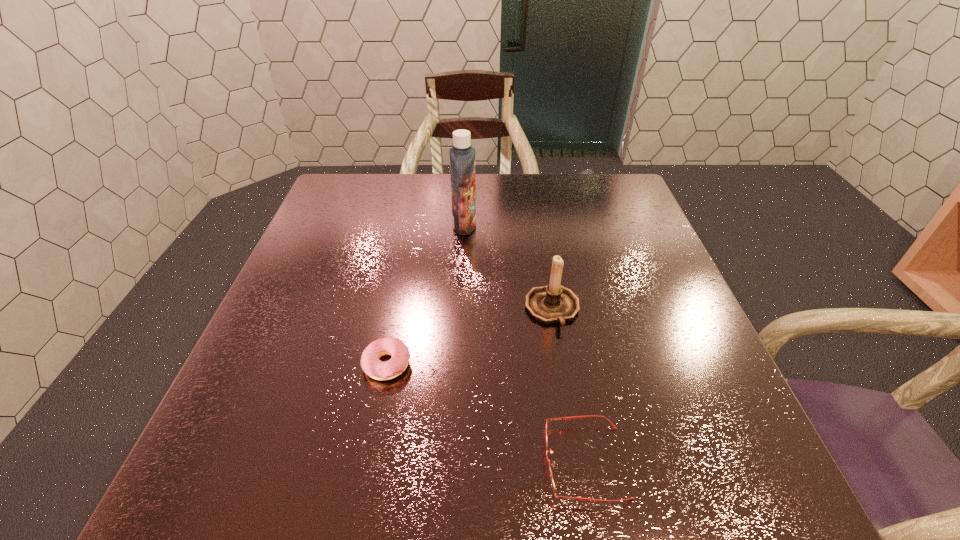
The height and width of the screenshot is (540, 960). Find the location of `object that is the third closest to the third farthest object`. object that is the third closest to the third farthest object is located at coordinates (462, 155).

Where is `object that ranks as the third closest to the second nearest object`? object that ranks as the third closest to the second nearest object is located at coordinates (462, 155).

Identify the location of free space that satisfies the following two spatial constraints: 1. on the front label of the shampoo; 2. on the left side of the third nearest object. (461, 309).

Where is `free location that satisfies the following two spatial constraints: 1. on the back side of the candle holder; 2. on the front label of the second object from left to right`? This screenshot has width=960, height=540. free location that satisfies the following two spatial constraints: 1. on the back side of the candle holder; 2. on the front label of the second object from left to right is located at coordinates (539, 225).

The image size is (960, 540). Find the location of `free location that satisfies the following two spatial constraints: 1. on the front label of the candle holder; 2. on the left side of the shampoo`. free location that satisfies the following two spatial constraints: 1. on the front label of the candle holder; 2. on the left side of the shampoo is located at coordinates (461, 309).